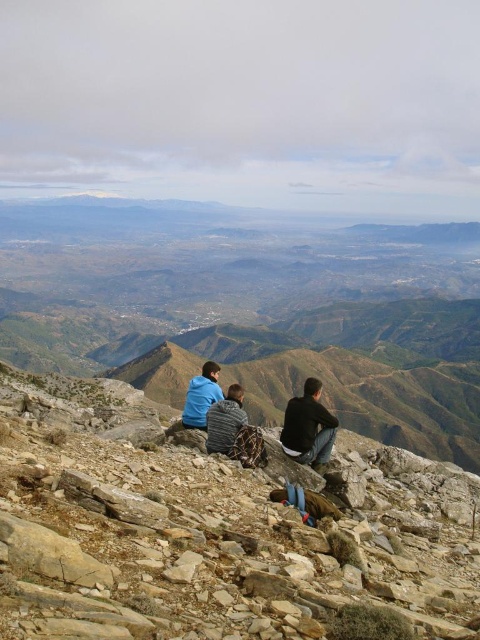
Consider the image. You are a hiker who wants to take a photo of the brown rocky mountain at center and the blue fabric jacket at lower left. Which object should you focus on first if you want to capture both in the same frame without moving the camera?

The blue fabric jacket at lower left should be focused on first because it is closer to the camera than the brown rocky mountain at center, which is further away. This way, both can be captured in the same frame without moving the camera.

You are a hiker planning to move from the point marked at coordinates point (x=7, y=576) to the point marked at coordinates point (x=204, y=376). Given the rocky terrain described, would you expect the path between these two points to be uphill or downhill?

The path from point (x=7, y=576) to point (x=204, y=376) is uphill because point (x=7, y=576) is closer to the viewer, indicating it is lower in elevation, while point (x=204, y=376) is farther away and likely higher up the slope.